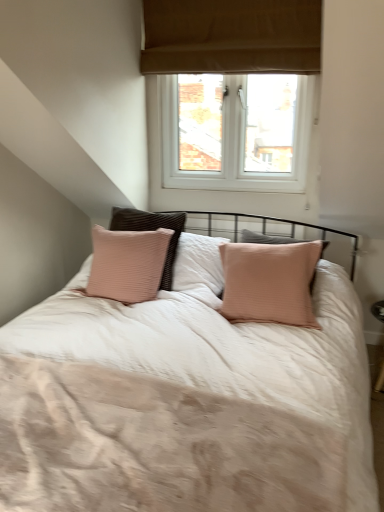
Locate an element on the screen. white plastic window at upper center is located at coordinates (236, 89).

This screenshot has height=512, width=384. What do you see at coordinates (236, 89) in the screenshot?
I see `white plastic window at upper center` at bounding box center [236, 89].

What is the approximate height of light beige fabric bed at center?

5.66 inches.

Image resolution: width=384 pixels, height=512 pixels. Describe the element at coordinates (185, 406) in the screenshot. I see `light beige fabric bed at center` at that location.

Measure the distance between point (x=109, y=423) and camera.

1.20 meters.

Locate an element on the screen. light beige fabric bed at center is located at coordinates (185, 406).

This screenshot has width=384, height=512. I want to click on white plastic window at upper center, so click(236, 89).

Considering the positions of objects light beige fabric bed at center and white plastic window at upper center in the image provided, who is more to the left, light beige fabric bed at center or white plastic window at upper center?

light beige fabric bed at center.

Considering their positions, is light beige fabric bed at center located in front of or behind white plastic window at upper center?

light beige fabric bed at center is positioned closer to the viewer than white plastic window at upper center.

Is point (324, 398) positioned behind point (205, 68)?

No, it is not.

Based on the photo, from the image's perspective, which one is positioned lower, light beige fabric bed at center or white plastic window at upper center?

light beige fabric bed at center.

From a real-world perspective, is light beige fabric bed at center on white plastic window at upper center?

No, from a real-world perspective, light beige fabric bed at center is not on top of white plastic window at upper center.

Can you confirm if light beige fabric bed at center is thinner than white plastic window at upper center?

In fact, light beige fabric bed at center might be wider than white plastic window at upper center.

Which of these two, light beige fabric bed at center or white plastic window at upper center, stands shorter?

light beige fabric bed at center is shorter.

Between light beige fabric bed at center and white plastic window at upper center, which one has smaller size?

light beige fabric bed at center.

Is white plastic window at upper center surrounded by light beige fabric bed at center?

No, light beige fabric bed at center does not contain white plastic window at upper center.

Is there a large distance between light beige fabric bed at center and white plastic window at upper center?

Yes, light beige fabric bed at center and white plastic window at upper center are located far from each other.

Is light beige fabric bed at center turned away from white plastic window at upper center?

No, light beige fabric bed at center is not facing the opposite direction of white plastic window at upper center.

Can you tell me how much light beige fabric bed at center and white plastic window at upper center differ in facing direction?

0.000848 degrees separate the facing orientations of light beige fabric bed at center and white plastic window at upper center.

The width and height of the screenshot is (384, 512). In the image, there is a white plastic window at upper center. Find the location of `bed below it (from a real-world perspective)`. bed below it (from a real-world perspective) is located at coordinates (185, 406).

Can you confirm if white plastic window at upper center is positioned to the left of light beige fabric bed at center?

In fact, white plastic window at upper center is to the right of light beige fabric bed at center.

Which object is further away from the camera taking this photo, white plastic window at upper center or light beige fabric bed at center?

white plastic window at upper center is behind.

Considering the positions of points (235, 122) and (228, 422), is point (235, 122) closer to camera compared to point (228, 422)?

No, it is not.

From the image's perspective, between white plastic window at upper center and light beige fabric bed at center, which one is located above?

From the image's view, white plastic window at upper center is above.

From the picture: From a real-world perspective, which object stands above the other?

white plastic window at upper center.

Can you confirm if white plastic window at upper center is wider than light beige fabric bed at center?

In fact, white plastic window at upper center might be narrower than light beige fabric bed at center.

Between white plastic window at upper center and light beige fabric bed at center, which one has less height?

light beige fabric bed at center is shorter.

Which of these two, white plastic window at upper center or light beige fabric bed at center, is bigger?

white plastic window at upper center is bigger.

Is white plastic window at upper center situated inside light beige fabric bed at center or outside?

white plastic window at upper center is outside light beige fabric bed at center.

Is white plastic window at upper center with light beige fabric bed at center?

No, white plastic window at upper center is not next to light beige fabric bed at center.

Is white plastic window at upper center aimed at light beige fabric bed at center?

Yes, white plastic window at upper center is facing light beige fabric bed at center.

Find the location of a particular element. The width and height of the screenshot is (384, 512). window that appears behind the light beige fabric bed at center is located at coordinates (236, 89).

I want to click on bed below the white plastic window at upper center (from a real-world perspective), so click(x=185, y=406).

Where is `bed on the left of the white plastic window at upper center`? The height and width of the screenshot is (512, 384). bed on the left of the white plastic window at upper center is located at coordinates (185, 406).